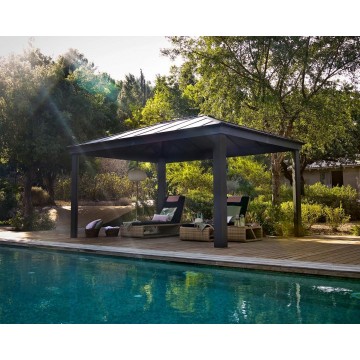
This screenshot has height=360, width=360. I want to click on side table, so click(247, 236).